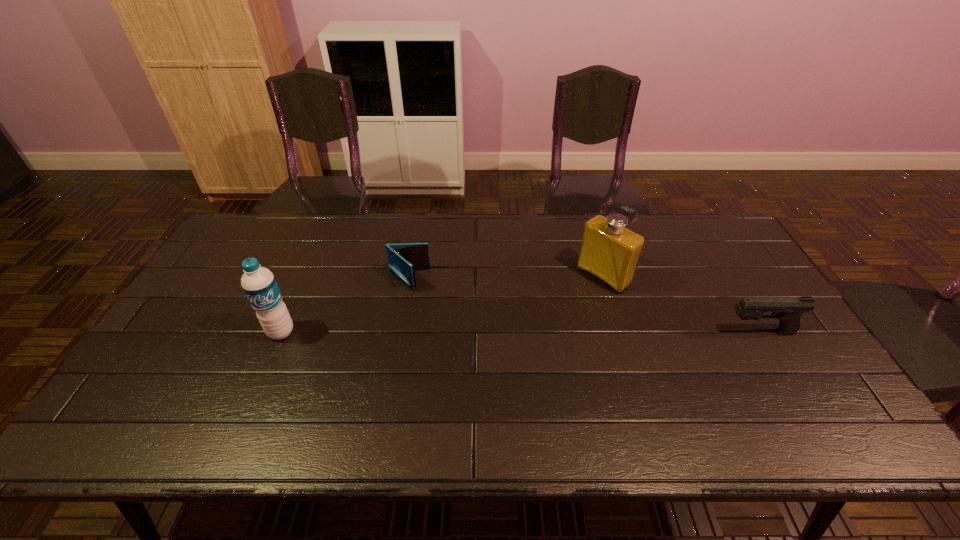
Locate an element on the screen. The width and height of the screenshot is (960, 540). blank area in the image that satisfies the following two spatial constraints: 1. on the front side of the rightmost object; 2. at the barrel of the third object from left to right is located at coordinates (620, 332).